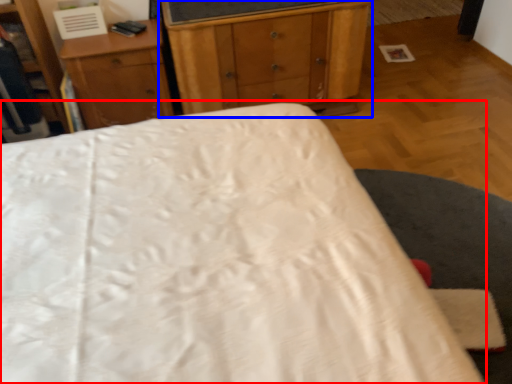
Question: Which point is further to the camera, bed (highlighted by a red box) or chest of drawers (highlighted by a blue box)?

Choices:
 (A) bed
 (B) chest of drawers

Answer: (B)